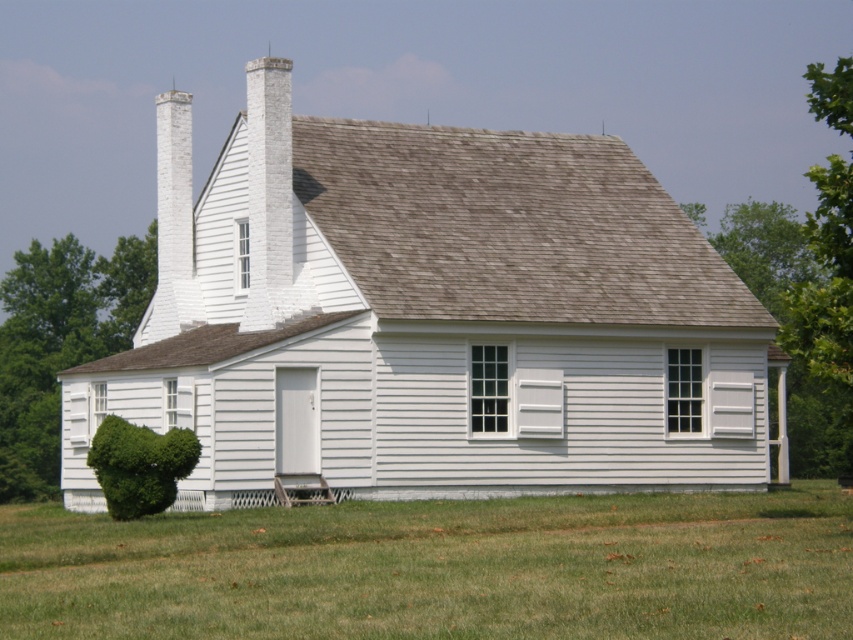
You are standing in front of the house and want to walk towards the green leafy bush at lower left. Which direction should you move relative to the green grass at lower center?

Since the green grass at lower center is closer to the viewer than the green leafy bush at lower left, you should move towards the left and away from the green grass at lower center to reach the green leafy bush at lower left.

You are a gardener planning to mow the green grass at lower center and trim the green leafy bush at lower left. Based on their current heights, which one should you tackle first according to standard gardening practices?

The green grass at lower center should be mowed first since it is shorter than the green leafy bush at lower left, and mowing is typically done before trimming bushes to avoid grass clippings getting into the shrubbery.